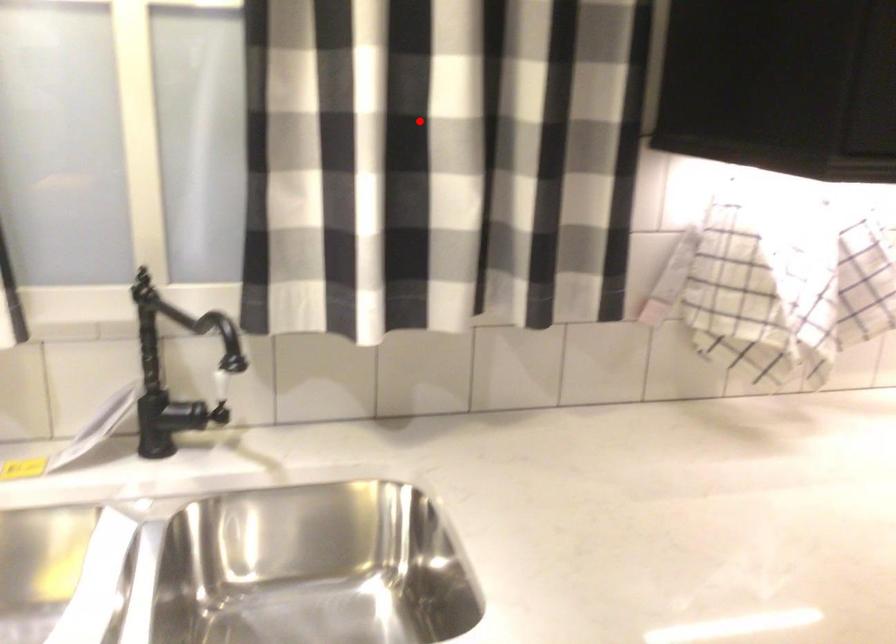
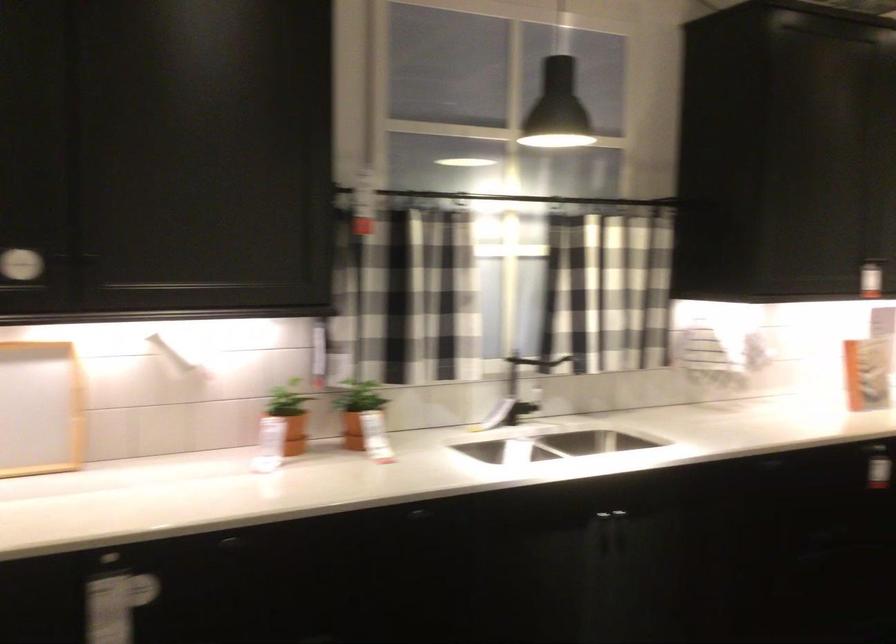
Question: I am providing you with two images of the same scene from different viewpoints. Given a red point in image1, look at the same physical point in image2. Is it:

Choices:
 (A) Closer to the viewpoint
 (B) Farther from the viewpoint

Answer: (B)